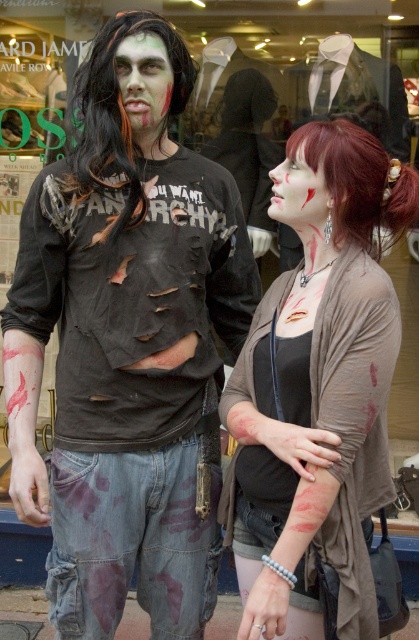
Question: Which object is the closest to the matte brown cardigan at center?

Choices:
 (A) dark brown synthetic wig at upper right
 (B) green matte face at center
 (C) black synthetic wig at upper left
 (D) ripped denim shirt at center

Answer: (D)

Question: Does black synthetic wig at upper left have a greater width compared to green matte face at center?

Choices:
 (A) yes
 (B) no

Answer: (A)

Question: Among these objects, which one is nearest to the camera?

Choices:
 (A) black synthetic wig at upper left
 (B) dark brown synthetic wig at upper right
 (C) green matte face at center
 (D) ripped denim shirt at center

Answer: (B)

Question: Which point is farther to the camera?

Choices:
 (A) ripped denim shirt at center
 (B) green matte face at center

Answer: (A)

Question: Is black synthetic wig at upper left positioned behind green matte face at center?

Choices:
 (A) yes
 (B) no

Answer: (B)

Question: Does matte brown cardigan at center lie behind dark brown synthetic wig at upper right?

Choices:
 (A) yes
 (B) no

Answer: (B)